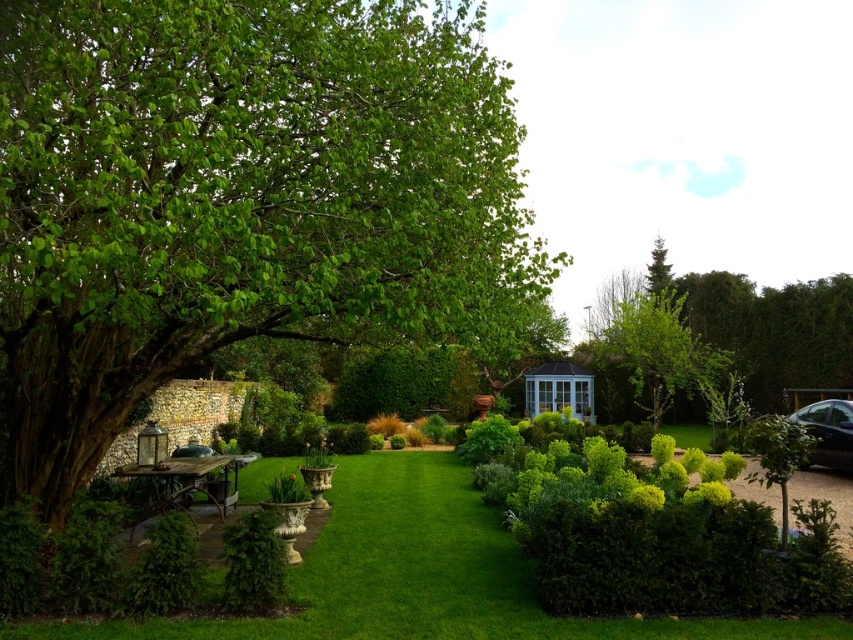
You are planning to place a new bench in the garden. The bench requires a space that is at least as large as the green leafy hedge at center. Can the area near the green leafy tree at left accommodate this bench?

The green leafy tree at left is larger in size than the green leafy hedge at center. Therefore, the area near the green leafy tree at left can accommodate the bench since it has enough space.

In the scene shown: You are standing in the garden and want to walk from the green leafy tree at left to the green leafy hedge at center. Which direction should you face to move directly towards the hedge?

You should face to the right because the green leafy tree at left is positioned on the right side of the green leafy hedge at center, meaning the hedge is to the left of the tree. Wait, this seems contradictory. Let me think again. If the tree is on the right side of the hedge, then the hedge is to the left of the tree. So to go from the tree to the hedge, you need to face left. Hmm, maybe I made a mistake here. Let me clarify the spatial relationship. The description says the tree is on the right side of h

You are standing in the garden and want to walk from the rustic wood picnic table at lower left to the black glossy car at lower right. Which object will you pass closer to as you move towards the car?

As you move from the rustic wood picnic table at lower left to the black glossy car at lower right, you will pass closer to the black glossy car at lower right because it is closer to you than the picnic table.